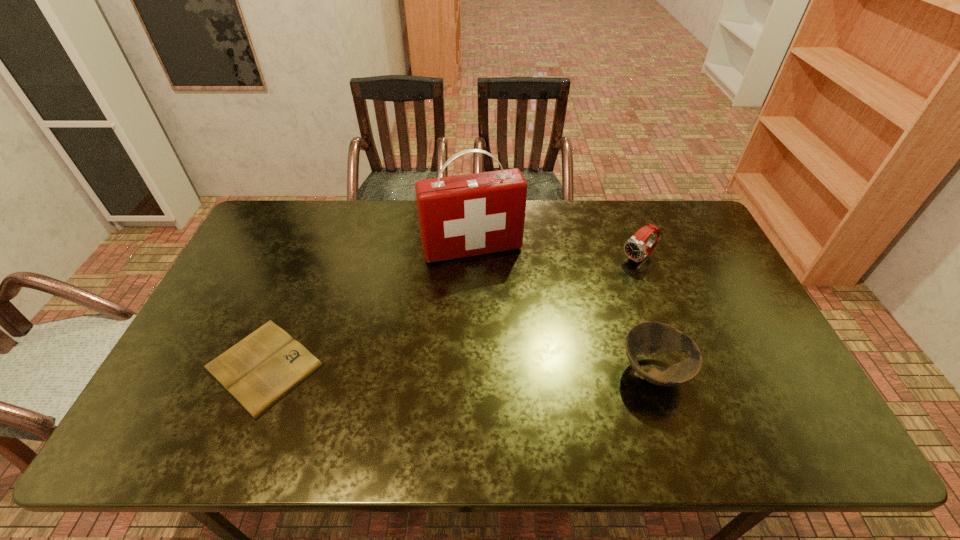
Find the location of `free space between the third tallest object and the book`. free space between the third tallest object and the book is located at coordinates (459, 368).

Locate an element on the screen. This screenshot has height=540, width=960. blank region between the watch and the third object from right to left is located at coordinates (556, 254).

Find the location of a particular element. The height and width of the screenshot is (540, 960). free space between the watch and the shortest object is located at coordinates (451, 312).

Locate which object is the closest to the leftmost object. Please provide its 2D coordinates. Your answer should be formatted as a tuple, i.e. [(x, y)], where the tuple contains the x and y coordinates of a point satisfying the conditions above.

[(473, 214)]

Identify which object is located as the second nearest to the shortest object. Please provide its 2D coordinates. Your answer should be formatted as a tuple, i.e. [(x, y)], where the tuple contains the x and y coordinates of a point satisfying the conditions above.

[(645, 338)]

Find the location of a particular element. free location that satisfies the following two spatial constraints: 1. on the back side of the leftmost object; 2. on the right side of the first-aid kit is located at coordinates (311, 248).

Where is `free spot that satisfies the following two spatial constraints: 1. on the back side of the second tallest object; 2. on the left side of the bowl`? Image resolution: width=960 pixels, height=540 pixels. free spot that satisfies the following two spatial constraints: 1. on the back side of the second tallest object; 2. on the left side of the bowl is located at coordinates point(617,259).

Locate an element on the screen. free spot that satisfies the following two spatial constraints: 1. on the back side of the second shortest object; 2. on the left side of the watch is located at coordinates (617, 259).

The height and width of the screenshot is (540, 960). Identify the location of free space that satisfies the following two spatial constraints: 1. on the back side of the shortest object; 2. on the left side of the first-aid kit. (311, 248).